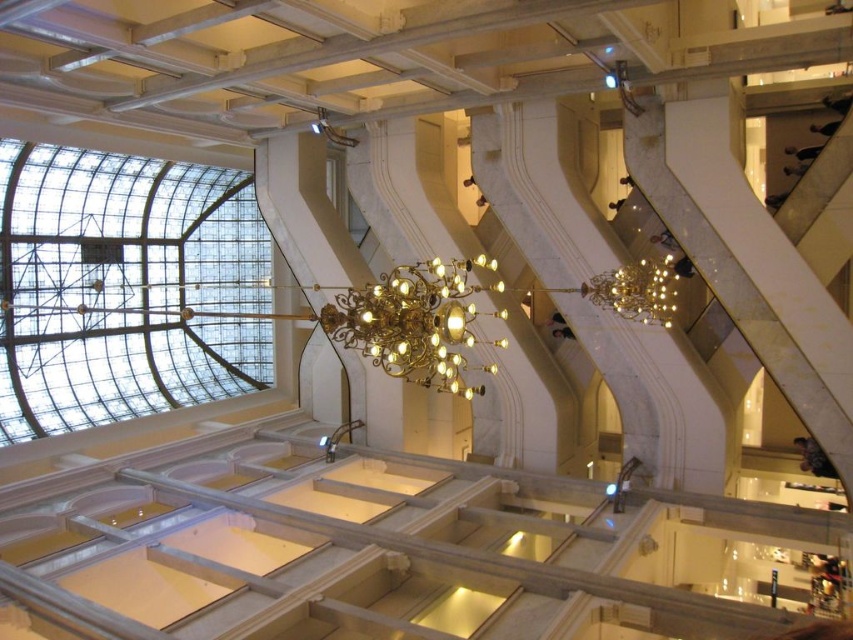
You are standing in the grand building and want to know how far the point at coordinates (25, 337) is from your current position. Can you determine the distance?

The point at coordinates (25, 337) is 45.02 meters away from your current position.

You are standing in the grand building and want to locate the transparent glass dome at upper center. According to its 2D coordinates, where should you look?

The transparent glass dome at upper center is located at the 2D coordinates point (125, 288), so you should look towards the upper center area of the scene.